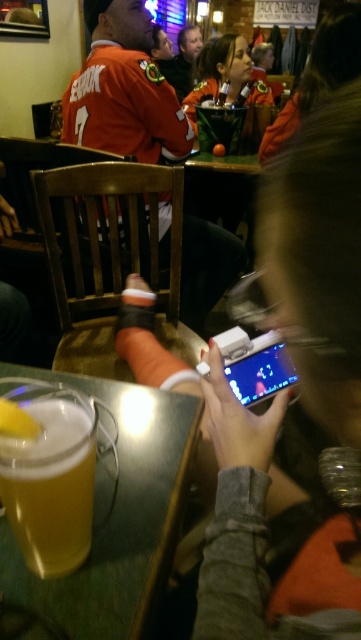
Between golden frothy beer at lower left and matte black jacket at center, which one has more height?

matte black jacket at center is taller.

Who is shorter, golden frothy beer at lower left or matte black jacket at center?

With less height is golden frothy beer at lower left.

Is point (76, 561) closer to camera compared to point (240, 38)?

Yes, it is in front of point (240, 38).

The height and width of the screenshot is (640, 361). I want to click on golden frothy beer at lower left, so click(x=50, y=477).

Between translucent glass mug at lower left and matte black jacket at center, which one is positioned higher?

Positioned higher is matte black jacket at center.

What do you see at coordinates (116, 515) in the screenshot?
I see `translucent glass mug at lower left` at bounding box center [116, 515].

At what (x,y) coordinates should I click in order to perform the action: click on translucent glass mug at lower left. Please return your answer as a coordinate pair (x, y). The width and height of the screenshot is (361, 640). Looking at the image, I should click on (116, 515).

Can you confirm if translucent glass mug at lower left is positioned above golden frothy beer at lower left?

Incorrect, translucent glass mug at lower left is not positioned above golden frothy beer at lower left.

Between point (164, 468) and point (53, 566), which one is positioned in front?

Point (53, 566) is in front.

Between point (20, 554) and point (67, 432), which one is positioned behind?

The point (20, 554) is behind.

Locate an element on the screen. The image size is (361, 640). translucent glass mug at lower left is located at coordinates (116, 515).